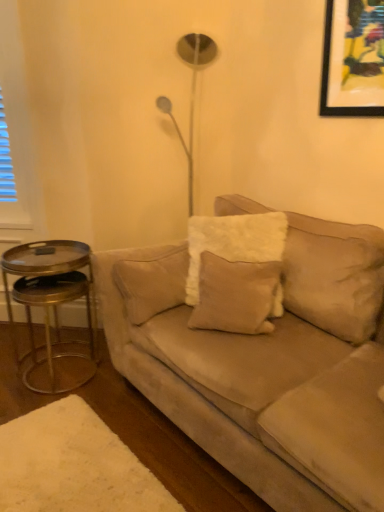
Question: Is point (201, 307) closer or farther from the camera than point (87, 357)?

Choices:
 (A) farther
 (B) closer

Answer: (B)

Question: From the image's perspective, is beige velvet pillow at center located above or below gold metallic side table at left?

Choices:
 (A) above
 (B) below

Answer: (A)

Question: Considering the real-world distances, which object is closest to the gold metallic side table at left?

Choices:
 (A) suede beige couch at center
 (B) beige velvet pillow at center

Answer: (A)

Question: Which of these objects is positioned farthest from the suede beige couch at center?

Choices:
 (A) beige velvet pillow at center
 (B) gold metallic side table at left

Answer: (B)